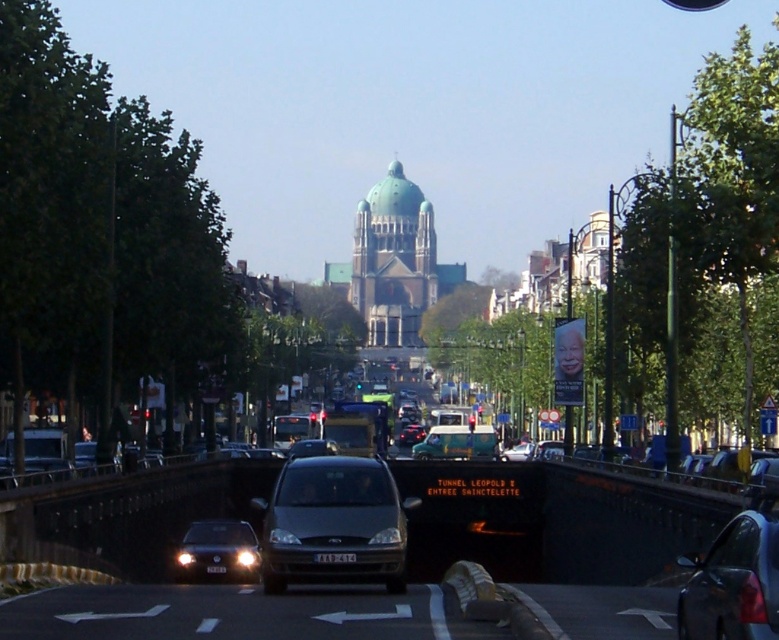
Question: Among these objects, which one is farthest from the camera?

Choices:
 (A) matte black van at center
 (B) black plastic license plate at center
 (C) green matte van at center

Answer: (C)

Question: Does matte gray van at center have a greater width compared to green glass traffic light at center?

Choices:
 (A) yes
 (B) no

Answer: (A)

Question: Which of these objects is positioned farthest from the green glass traffic light at center?

Choices:
 (A) black plastic license plate at center
 (B) matte black van at center
 (C) white plastic license plate at center
 (D) shiny black sedan at lower right

Answer: (D)

Question: Is white plastic license plate at center wider than black plastic license plate at center?

Choices:
 (A) yes
 (B) no

Answer: (A)

Question: Can you confirm if metallic gray van at center is positioned below green glass traffic light at center?

Choices:
 (A) yes
 (B) no

Answer: (B)

Question: Which of these objects is positioned farthest from the matte black van at center?

Choices:
 (A) shiny silver sedan at center
 (B) green matte van at center
 (C) metallic gray van at center

Answer: (B)